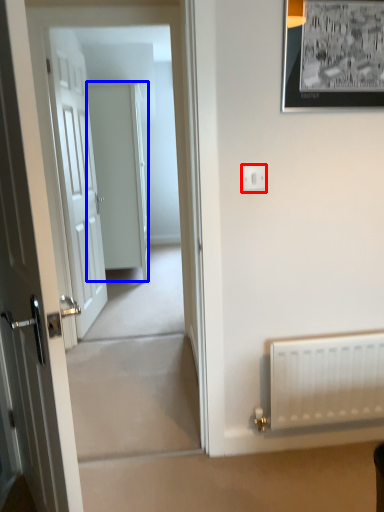
Question: Which of the following is the farthest to the observer, electric outlet (highlighted by a red box) or door (highlighted by a blue box)?

Choices:
 (A) electric outlet
 (B) door

Answer: (B)